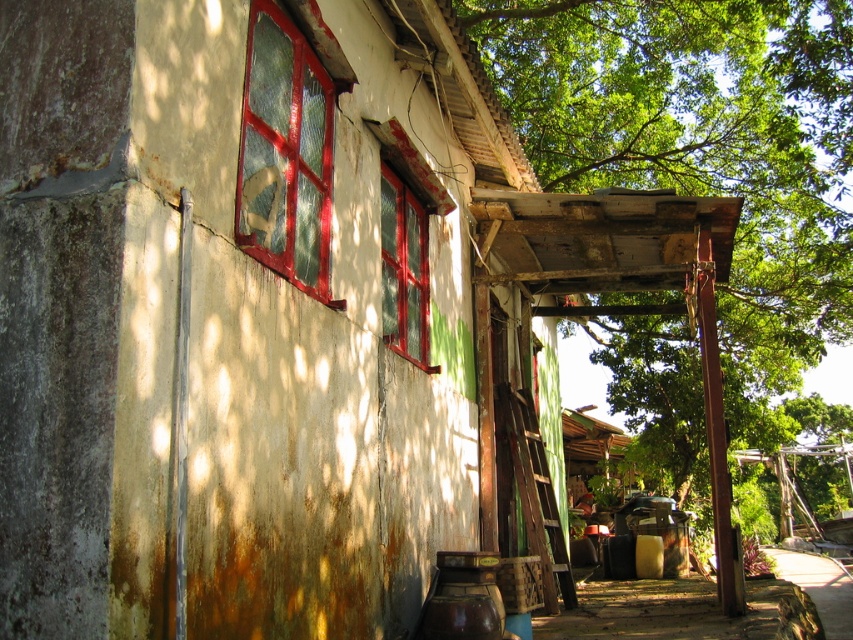
You are standing in front of the weathered building and want to locate the green leafy tree at upper right. According to the coordinates given, where would you look to find it?

The green leafy tree at upper right is located at point (704, 147).

You are standing in front of the weathered building and notice the green leafy tree at upper right and the cracked glass window at left. Which object is positioned higher up in the scene?

The green leafy tree at upper right is located above the cracked glass window at left, so it is positioned higher up in the scene.